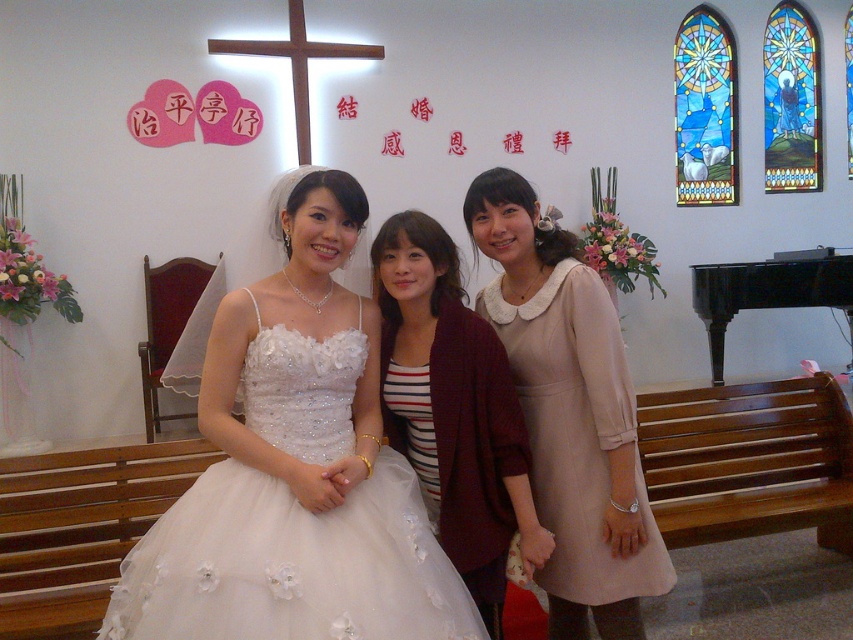
Question: Among these objects, which one is nearest to the camera?

Choices:
 (A) white satin dress at center
 (B) beige satin dress at center

Answer: (B)

Question: Which is nearer to the white tulle dress at center?

Choices:
 (A) white satin dress at center
 (B) beige satin dress at center
 (C) black piano at right

Answer: (A)

Question: Which point is closer to the camera?

Choices:
 (A) (786, 304)
 (B) (567, 419)
 (C) (498, 451)

Answer: (C)

Question: Does white tulle dress at center appear over black piano at right?

Choices:
 (A) no
 (B) yes

Answer: (A)

Question: Can you confirm if white satin dress at center is wider than black piano at right?

Choices:
 (A) no
 (B) yes

Answer: (A)

Question: Observing the image, what is the correct spatial positioning of white satin dress at center in reference to beige satin dress at center?

Choices:
 (A) right
 (B) left

Answer: (B)